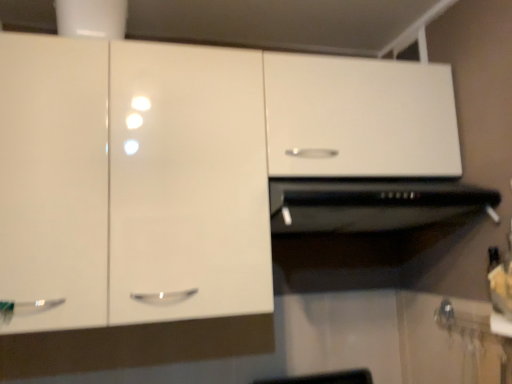
Question: From the image's perspective, is white glossy cabinet at upper center below black matte vent at center?

Choices:
 (A) no
 (B) yes

Answer: (A)

Question: Considering the relative positions of white glossy cabinet at upper center and black matte vent at center in the image provided, is white glossy cabinet at upper center in front of black matte vent at center?

Choices:
 (A) no
 (B) yes

Answer: (B)

Question: Is white glossy cabinet at upper center wider than black matte vent at center?

Choices:
 (A) yes
 (B) no

Answer: (B)

Question: Is white glossy cabinet at upper center positioned beyond the bounds of black matte vent at center?

Choices:
 (A) no
 (B) yes

Answer: (B)

Question: Considering the relative sizes of white glossy cabinet at upper center and black matte vent at center in the image provided, is white glossy cabinet at upper center shorter than black matte vent at center?

Choices:
 (A) yes
 (B) no

Answer: (B)

Question: From a real-world perspective, does white glossy cabinet at upper center stand above black matte vent at center?

Choices:
 (A) no
 (B) yes

Answer: (B)

Question: Considering the relative sizes of black matte vent at center and white glossy cabinet at upper center in the image provided, is black matte vent at center wider than white glossy cabinet at upper center?

Choices:
 (A) no
 (B) yes

Answer: (B)

Question: From the image's perspective, does black matte vent at center appear lower than white glossy cabinet at upper center?

Choices:
 (A) no
 (B) yes

Answer: (B)

Question: Is black matte vent at center facing away from white glossy cabinet at upper center?

Choices:
 (A) no
 (B) yes

Answer: (B)

Question: From the image's perspective, is black matte vent at center above white glossy cabinet at upper center?

Choices:
 (A) yes
 (B) no

Answer: (B)

Question: Can you confirm if black matte vent at center is thinner than white glossy cabinet at upper center?

Choices:
 (A) yes
 (B) no

Answer: (B)

Question: From a real-world perspective, is black matte vent at center on top of white glossy cabinet at upper center?

Choices:
 (A) yes
 (B) no

Answer: (B)

Question: Is black matte vent at center taller or shorter than white glossy cabinet at upper center?

Choices:
 (A) tall
 (B) short

Answer: (B)